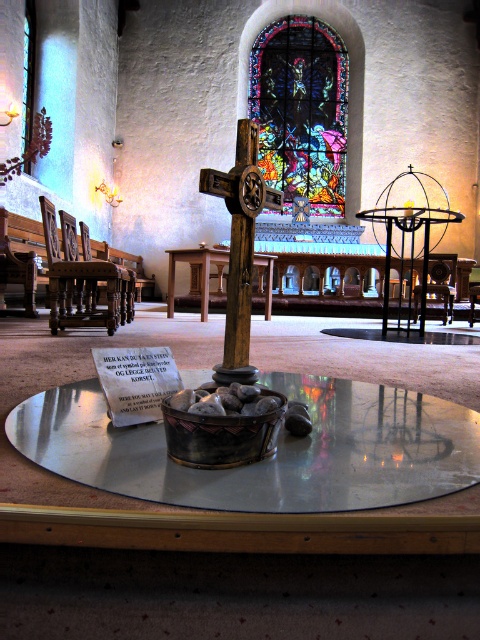
You are standing in the church and notice two points marked on the floor. One is at point (292, 74) and the other at point (439, 253). If you are facing the altar, which point is closer to the entrance of the church?

Point (292, 74) is behind point (439, 253), so if you are facing the altar, the entrance is likely behind you. Therefore, point (439, 253) is closer to the entrance since it is in front of point (292, 74).

You are a visitor to the church and want to sit down. You notice the dark brown wood chair at left and the wooden polished bench at left. Which one is taller?

The dark brown wood chair at left is taller than the wooden polished bench at left.

Looking at this image, you are standing in the church and want to know how far the point at coordinates [69,234] is from you. Can you determine the distance?

The distance of point [69,234] from viewer is 17.79 feet.